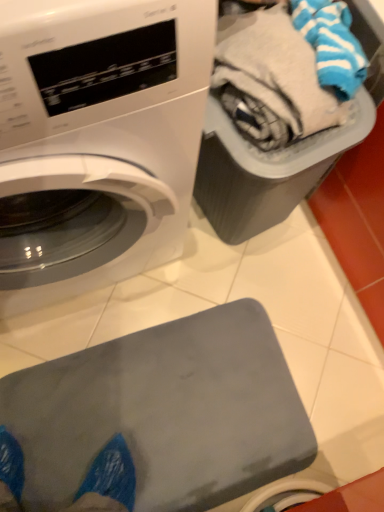
Question: Can you confirm if plastic gray bin at upper right is smaller than white glossy washing machine at upper left?

Choices:
 (A) yes
 (B) no

Answer: (A)

Question: Can you confirm if plastic gray bin at upper right is positioned to the right of white glossy washing machine at upper left?

Choices:
 (A) yes
 (B) no

Answer: (A)

Question: Is plastic gray bin at upper right wider than white glossy washing machine at upper left?

Choices:
 (A) no
 (B) yes

Answer: (A)

Question: Is the depth of plastic gray bin at upper right less than that of white glossy washing machine at upper left?

Choices:
 (A) no
 (B) yes

Answer: (A)

Question: Is plastic gray bin at upper right completely or partially outside of white glossy washing machine at upper left?

Choices:
 (A) no
 (B) yes

Answer: (B)

Question: Is plastic gray bin at upper right far from white glossy washing machine at upper left?

Choices:
 (A) no
 (B) yes

Answer: (A)

Question: Is plastic gray bin at upper right surrounded by white glossy washing machine at upper left?

Choices:
 (A) yes
 (B) no

Answer: (B)

Question: Is plastic gray bin at upper right at the back of white glossy washing machine at upper left?

Choices:
 (A) no
 (B) yes

Answer: (A)

Question: From the image's perspective, is white glossy washing machine at upper left located above plastic gray bin at upper right?

Choices:
 (A) yes
 (B) no

Answer: (B)

Question: Is white glossy washing machine at upper left facing towards plastic gray bin at upper right?

Choices:
 (A) no
 (B) yes

Answer: (A)

Question: Is the position of white glossy washing machine at upper left more distant than that of plastic gray bin at upper right?

Choices:
 (A) no
 (B) yes

Answer: (A)

Question: Is white glossy washing machine at upper left not near plastic gray bin at upper right?

Choices:
 (A) yes
 (B) no

Answer: (B)

Question: Is gray rubber mat at lower center facing towards plastic gray bin at upper right?

Choices:
 (A) yes
 (B) no

Answer: (B)